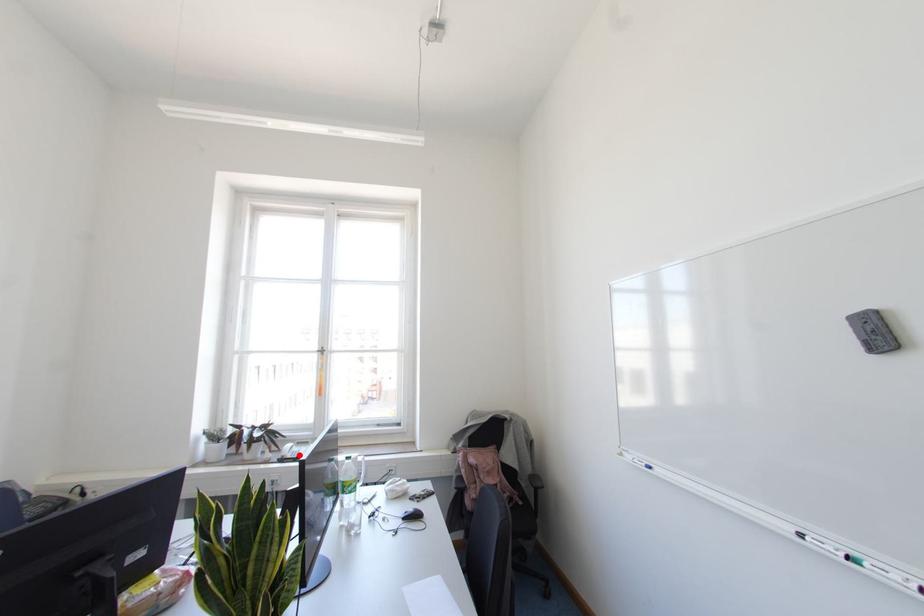
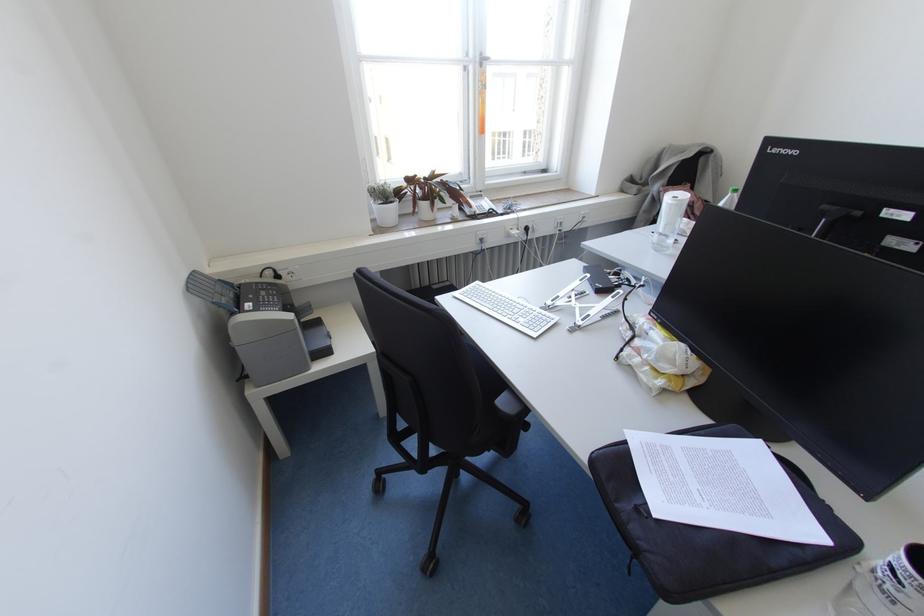
In the second image, find the point that corresponds to the highlighted location in the first image.

(490, 209)